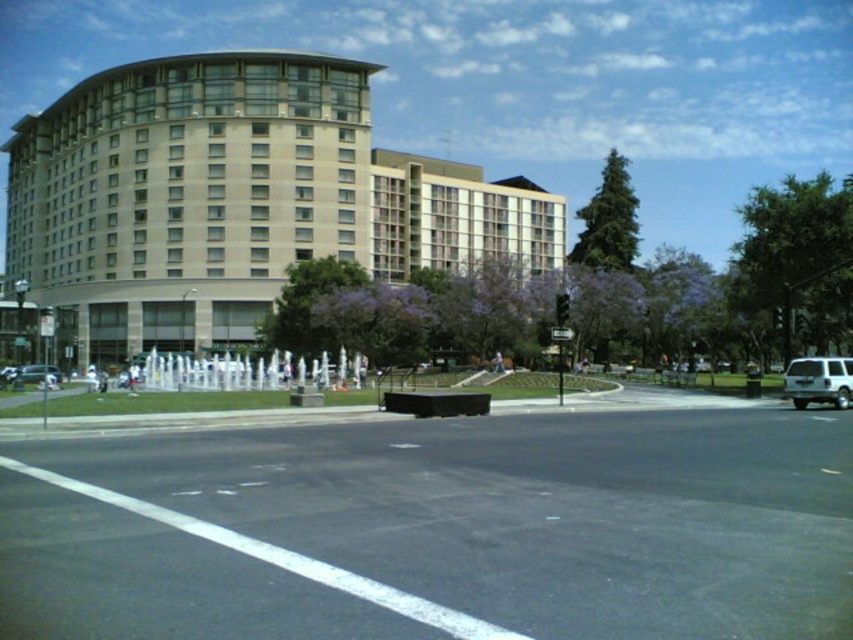
You are standing in front of the beige glass building at upper left and want to see the silver metallic sedan at lower left. In which direction should you look relative to your current position?

The beige glass building at upper left is above the silver metallic sedan at lower left, so you should look downward to see the silver metallic sedan at lower left from your current position.

You are standing in front of the building and want to reach the point marked at coordinates point (337, 109). If your walking speed is 1.5 meters per second, how many seconds will it take you to reach that point?

The point (337, 109) is 108.62 meters away from the camera. At a walking speed of 1.5 meters per second, it would take approximately 72.41 seconds to reach the point.